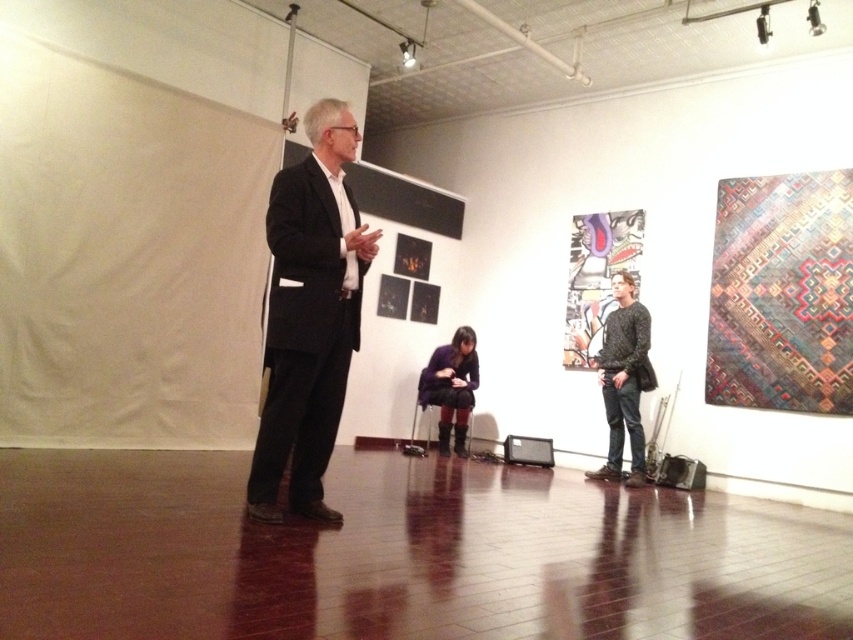
You are standing at the center of the room where the man in the dark suit is speaking. You want to move to the point closer to the right wall. Which point should you go to, point (637, 440) or point (451, 396)?

Point (637, 440) is in front of point (451, 396), so to reach the point closer to the right wall, you should go to point (451, 396).

You are an attendee at an event and you see the matte black suit at center and the purple fuzzy sweater at center. Which one is positioned to the left?

The matte black suit at center is positioned to the left of the purple fuzzy sweater at center.

You are an artist preparing for a presentation. You have a knitted sweater at right and a purple fuzzy sweater at center. Which sweater is more suitable for a presentation if you want to appear professional?

The knitted sweater at right is thinner than the purple fuzzy sweater at center, so the knitted sweater at right would be more suitable for a professional presentation as it appears more streamlined and formal.